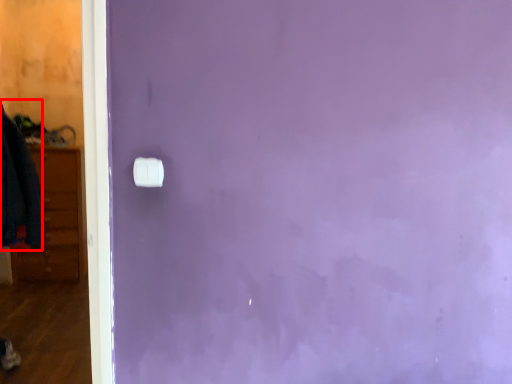
Question: In this image, where is clothing (annotated by the red box) located relative to light switch?

Choices:
 (A) right
 (B) left

Answer: (B)